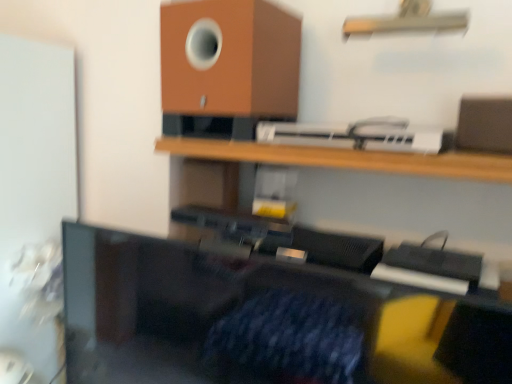
Question: Considering the positions of point (178, 19) and point (190, 152), is point (178, 19) closer or farther from the camera than point (190, 152)?

Choices:
 (A) farther
 (B) closer

Answer: (B)

Question: Is brown matte speaker at upper center in front of or behind wooden shelf at upper center, the first shelf ordered from the bottom, in the image?

Choices:
 (A) front
 (B) behind

Answer: (B)

Question: Which object is positioned farthest from the metallic silver shelf at upper center, marked as the 2th shelf in a bottom-to-top arrangement?

Choices:
 (A) wooden shelf at upper center, the second shelf positioned from the top
 (B) white plastic printer at upper center
 (C) black plastic monitor at center
 (D) brown matte speaker at upper center

Answer: (C)

Question: Based on their relative distances, which object is nearer to the brown matte speaker at upper center?

Choices:
 (A) black plastic monitor at center
 (B) white plastic printer at upper center
 (C) wooden shelf at upper center, the first shelf ordered from the bottom
 (D) metallic silver shelf at upper center, positioned as the 1th shelf in top-to-bottom order

Answer: (B)